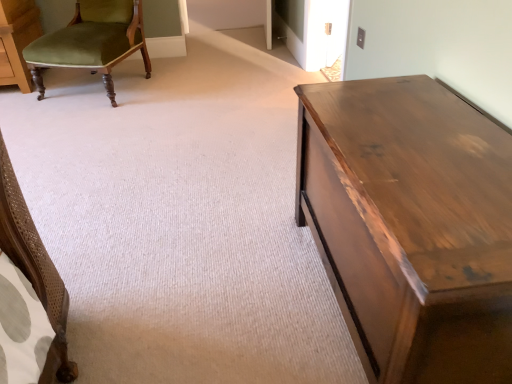
Question: Would you say green velvet chair at upper left is inside or outside shiny brown wood table at right?

Choices:
 (A) outside
 (B) inside

Answer: (A)

Question: In terms of size, does green velvet chair at upper left appear bigger or smaller than shiny brown wood table at right?

Choices:
 (A) small
 (B) big

Answer: (B)

Question: In the image, is green velvet chair at upper left on the left side or the right side of shiny brown wood table at right?

Choices:
 (A) right
 (B) left

Answer: (B)

Question: Is point (495, 124) closer or farther from the camera than point (96, 46)?

Choices:
 (A) closer
 (B) farther

Answer: (A)

Question: Is shiny brown wood table at right inside the boundaries of green velvet chair at upper left, or outside?

Choices:
 (A) outside
 (B) inside

Answer: (A)

Question: Is shiny brown wood table at right to the left or to the right of green velvet chair at upper left in the image?

Choices:
 (A) left
 (B) right

Answer: (B)

Question: In terms of height, does shiny brown wood table at right look taller or shorter compared to green velvet chair at upper left?

Choices:
 (A) tall
 (B) short

Answer: (B)